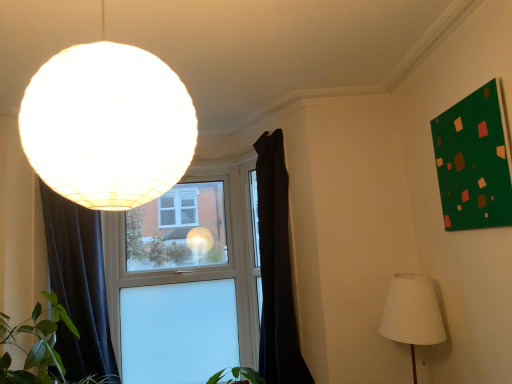
Question: In terms of size, does green matte board at upper right appear bigger or smaller than dark fabric curtain at left, which is the first curtain in left-to-right order?

Choices:
 (A) big
 (B) small

Answer: (B)

Question: From a real-world perspective, is green matte board at upper right above or below dark fabric curtain at left, which is the first curtain in left-to-right order?

Choices:
 (A) above
 (B) below

Answer: (A)

Question: Estimate the real-world distances between objects in this image. Which object is closer to the white fabric lampshade at lower right, acting as the first lamp starting from the bottom?

Choices:
 (A) green matte board at upper right
 (B) transparent glass window at center
 (C) matte white globe at upper left, arranged as the 1th lamp when viewed from the left
 (D) dark fabric curtain at center, which is the 1th curtain in right-to-left order
 (E) dark fabric curtain at left, positioned as the second curtain in right-to-left order

Answer: (A)

Question: Which of these objects is positioned closest to the matte white globe at upper left, the 1th lamp positioned from the front?

Choices:
 (A) white fabric lampshade at lower right, placed as the second lamp when sorted from front to back
 (B) transparent glass window at center
 (C) green matte board at upper right
 (D) dark fabric curtain at center, which is the 1th curtain in right-to-left order
 (E) dark fabric curtain at left, which is the first curtain in left-to-right order

Answer: (C)